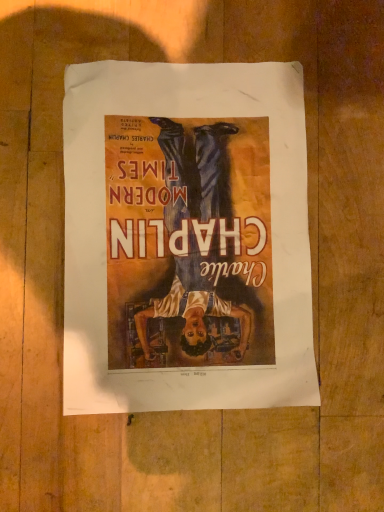
Locate an element on the screen. This screenshot has width=384, height=512. free space above matte paper poster at center (from a real-world perspective) is located at coordinates (202, 251).